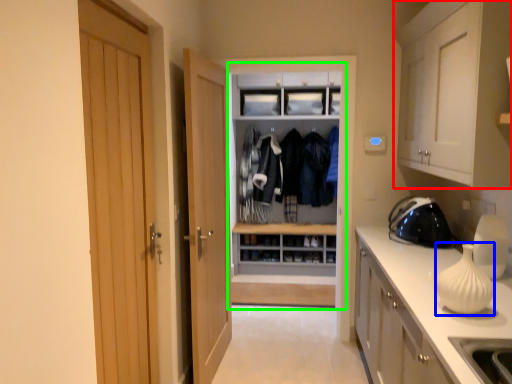
Question: Based on their relative distances, which object is nearer to cabinetry (highlighted by a red box)? Choose from vase (highlighted by a blue box) and dresser (highlighted by a green box).

Choices:
 (A) vase
 (B) dresser

Answer: (A)